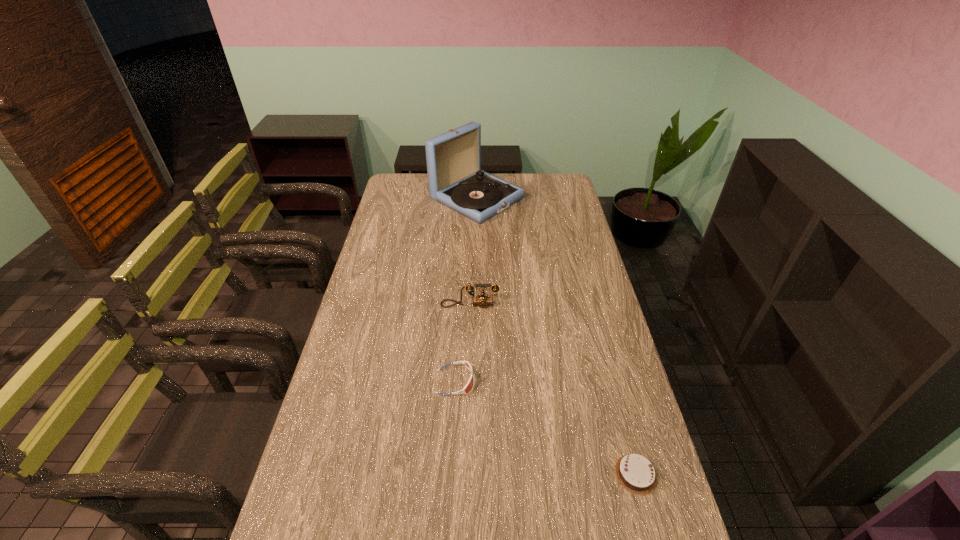
Where is `vacant point located between the tallest object and the second shortest object`? This screenshot has width=960, height=540. vacant point located between the tallest object and the second shortest object is located at coordinates (466, 290).

This screenshot has width=960, height=540. I want to click on free space between the nearest object and the third nearest object, so click(553, 389).

Identify the location of free space that is in between the farthest object and the goggles. pyautogui.click(x=466, y=290).

Where is `vacant space that's between the nearest object and the telephone`? vacant space that's between the nearest object and the telephone is located at coordinates (553, 389).

Identify the location of unoccupied position between the tallest object and the second tallest object. Image resolution: width=960 pixels, height=540 pixels. (473, 252).

This screenshot has width=960, height=540. What are the coordinates of `vacant area between the third shortest object and the second nearest object` in the screenshot? It's located at (463, 343).

Point out which object is positioned as the nearest to the rightmost object. Please provide its 2D coordinates. Your answer should be formatted as a tuple, i.e. [(x, y)], where the tuple contains the x and y coordinates of a point satisfying the conditions above.

[(469, 385)]

You are a GUI agent. You are given a task and a screenshot of the screen. Output one action in this format:
    pyautogui.click(x=<x>, y=<y>)
    Task: Click on the third closest object relative to the third farthest object
    This screenshot has width=960, height=540.
    Given the screenshot: What is the action you would take?
    click(455, 179)

I want to click on free space that satisfies the following two spatial constraints: 1. on the front side of the phonograph record; 2. on the right side of the chocolate cake, so click(473, 474).

Find the location of a particular element. This screenshot has width=960, height=540. vacant space that satisfies the following two spatial constraints: 1. on the front-facing side of the rightmost object; 2. on the right side of the telephone is located at coordinates (466, 474).